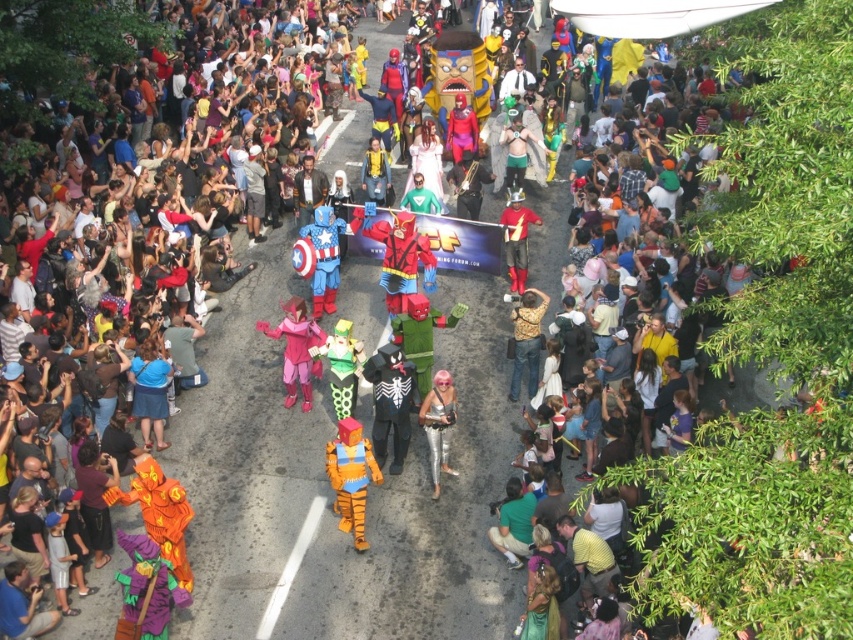
Question: Which object appears closest to the camera in this image?

Choices:
 (A) gold metallic jacket at center
 (B) shiny metallic costume at center
 (C) orange fabric tiger at center
 (D) silver metallic jumpsuit at center

Answer: (C)

Question: Considering the real-world distances, which object is closest to the blue matte captain america costume at center?

Choices:
 (A) silver metallic jumpsuit at center
 (B) shiny metallic costume at center
 (C) pink fabric costume at center
 (D) gold metallic jacket at center

Answer: (C)

Question: Which of the following is the farthest from the observer?

Choices:
 (A) (523, 317)
 (B) (363, 512)
 (C) (311, 330)
 (D) (309, 227)

Answer: (D)

Question: Is blue matte captain america costume at center thinner than shiny metallic costume at center?

Choices:
 (A) yes
 (B) no

Answer: (A)

Question: Can you confirm if pink fabric costume at center is thinner than silver metallic jumpsuit at center?

Choices:
 (A) yes
 (B) no

Answer: (B)

Question: Is pink fabric costume at center to the left of gold metallic jacket at center from the viewer's perspective?

Choices:
 (A) no
 (B) yes

Answer: (B)